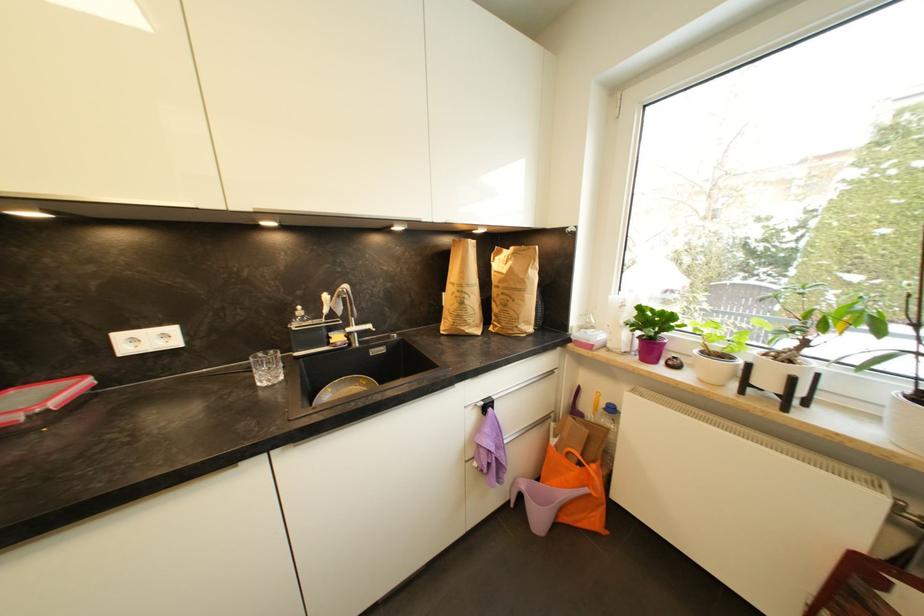
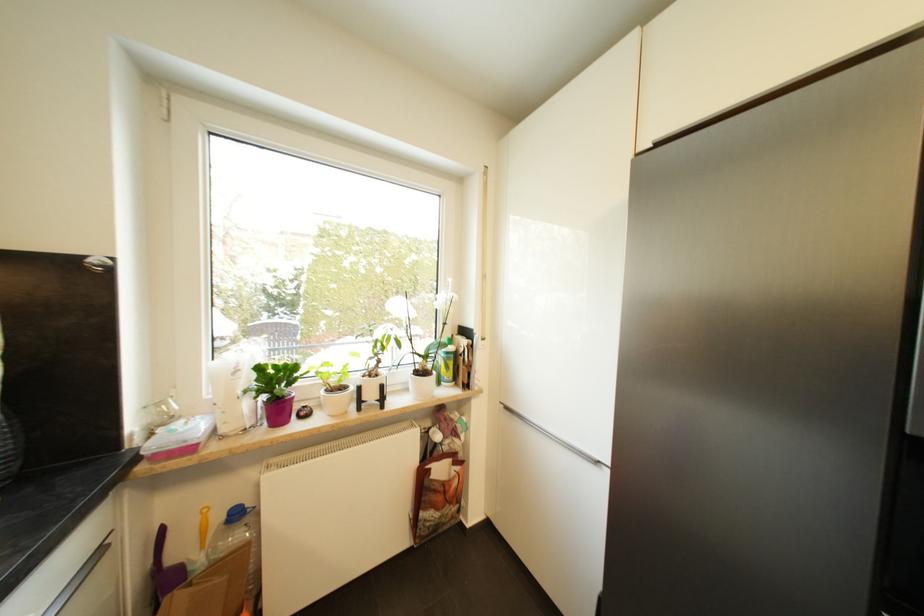
The point at (556, 374) is marked in the first image. Where is the corresponding point in the second image?

(105, 553)